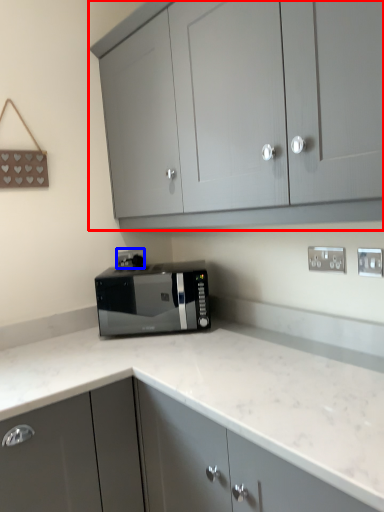
Question: Which of the following is the closest to the observer, cabinetry (highlighted by a red box) or electric outlet (highlighted by a blue box)?

Choices:
 (A) cabinetry
 (B) electric outlet

Answer: (A)